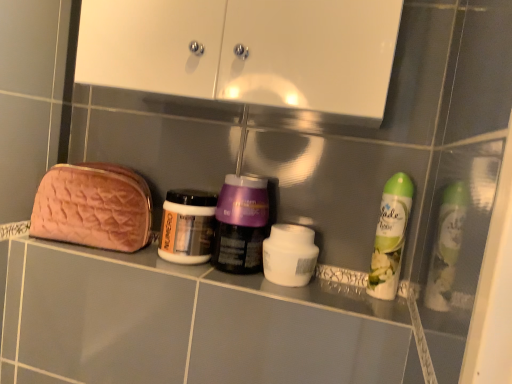
Question: Can we say white matte jar at center lies outside metallic silver jar at center, which is counted as the first bottle, starting from the left?

Choices:
 (A) yes
 (B) no

Answer: (A)

Question: From a real-world perspective, is white matte jar at center physically above metallic silver jar at center, which is counted as the first bottle, starting from the left?

Choices:
 (A) yes
 (B) no

Answer: (B)

Question: Is metallic silver jar at center, which is counted as the first bottle, starting from the left, at the back of white matte jar at center?

Choices:
 (A) yes
 (B) no

Answer: (B)

Question: Is white matte jar at center not close to metallic silver jar at center, which ranks as the 3th bottle in right-to-left order?

Choices:
 (A) yes
 (B) no

Answer: (B)

Question: Is metallic silver jar at center, which is counted as the first bottle, starting from the left, completely or partially inside white matte jar at center?

Choices:
 (A) no
 (B) yes

Answer: (A)

Question: From their relative heights in the image, would you say white glossy cabinet at upper center is taller or shorter than metallic silver jar at center, which is counted as the first bottle, starting from the left?

Choices:
 (A) short
 (B) tall

Answer: (B)

Question: From a real-world perspective, is white glossy cabinet at upper center positioned above or below metallic silver jar at center, which ranks as the 3th bottle in right-to-left order?

Choices:
 (A) below
 (B) above

Answer: (B)

Question: Considering the positions of white glossy cabinet at upper center and metallic silver jar at center, which ranks as the 3th bottle in right-to-left order, in the image, is white glossy cabinet at upper center wider or thinner than metallic silver jar at center, which ranks as the 3th bottle in right-to-left order,?

Choices:
 (A) thin
 (B) wide

Answer: (B)

Question: Would you say white glossy cabinet at upper center is inside or outside metallic silver jar at center, which is counted as the first bottle, starting from the left?

Choices:
 (A) inside
 (B) outside

Answer: (B)

Question: From the image's perspective, is white glossy cabinet at upper center positioned above or below white matte air freshener at right, positioned as the 1th bottle in right-to-left order?

Choices:
 (A) below
 (B) above

Answer: (B)

Question: In terms of size, does white glossy cabinet at upper center appear bigger or smaller than white matte air freshener at right, acting as the third bottle starting from the left?

Choices:
 (A) small
 (B) big

Answer: (B)

Question: Considering their positions, is white glossy cabinet at upper center located in front of or behind white matte air freshener at right, positioned as the 1th bottle in right-to-left order?

Choices:
 (A) front
 (B) behind

Answer: (A)

Question: Is white glossy cabinet at upper center to the left or to the right of white matte air freshener at right, positioned as the 1th bottle in right-to-left order, in the image?

Choices:
 (A) right
 (B) left

Answer: (B)

Question: Is purple glossy jar at center, which ranks as the second bottle in right-to-left order, wider or thinner than white matte air freshener at right, acting as the third bottle starting from the left?

Choices:
 (A) thin
 (B) wide

Answer: (B)

Question: From a real-world perspective, relative to white matte air freshener at right, acting as the third bottle starting from the left, is purple glossy jar at center, arranged as the second bottle when viewed from the left, vertically above or below?

Choices:
 (A) below
 (B) above

Answer: (A)